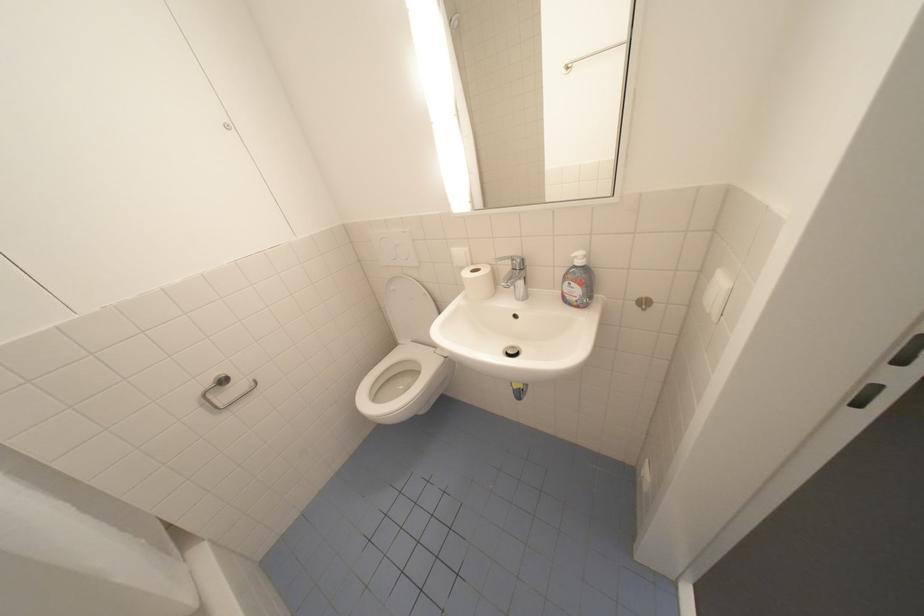
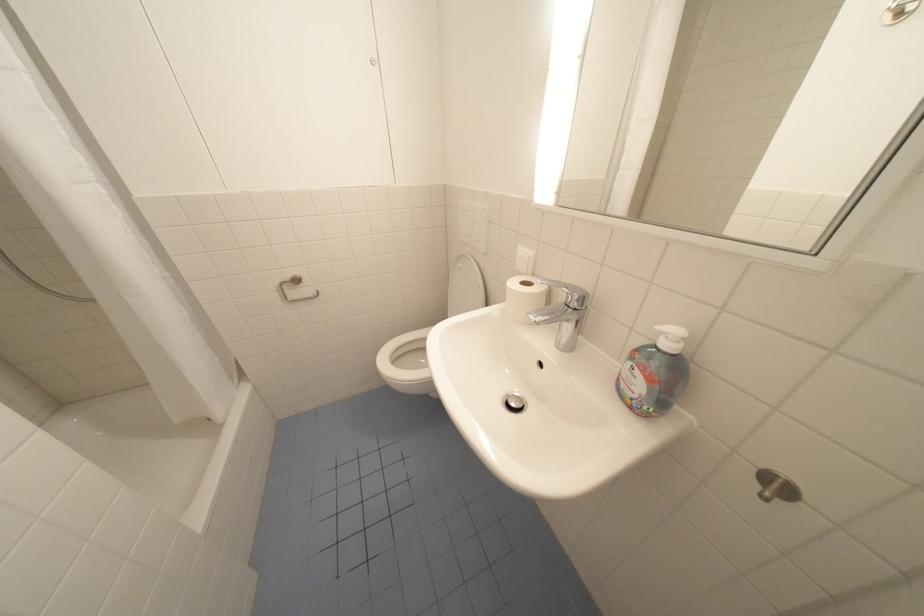
In the second image, find the point that corresponds to (x=399, y=289) in the first image.

(468, 265)